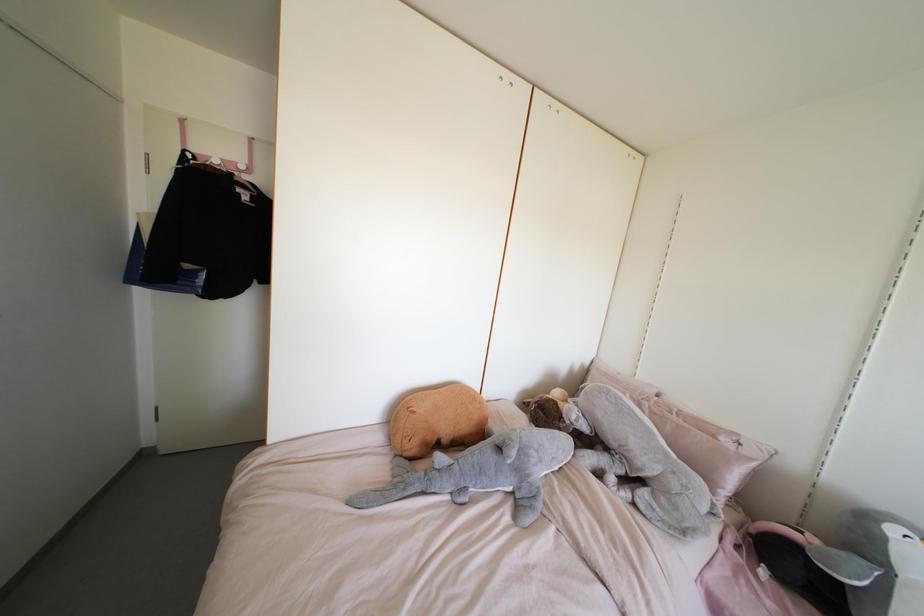
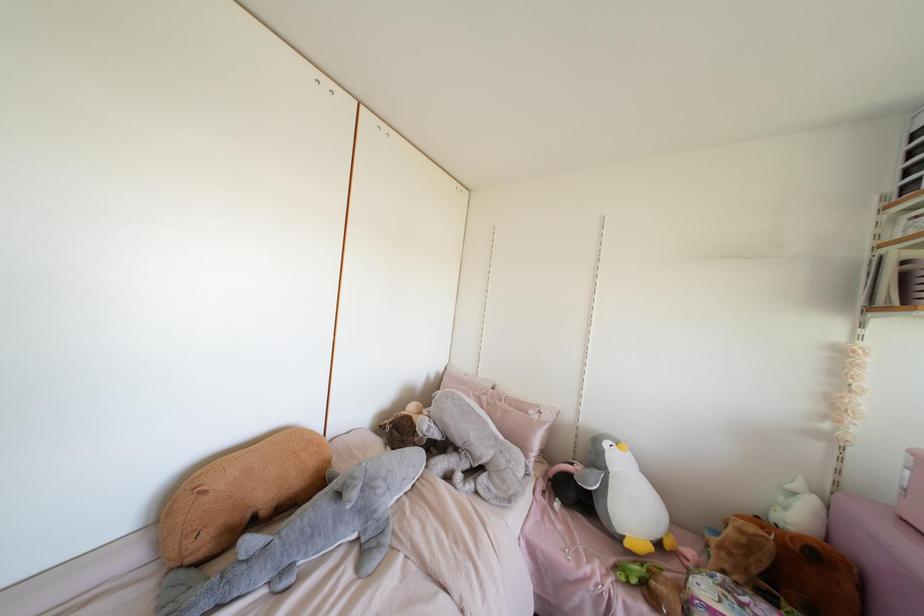
Find the pixel in the second image that matches pixel 722 439 in the first image.

(530, 411)